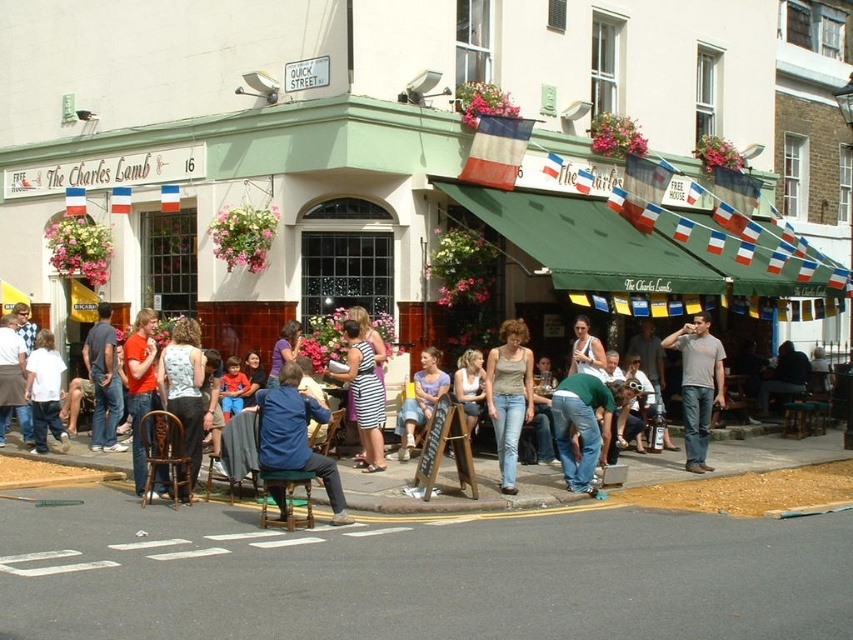
Question: Which of these objects is positioned closest to the denim shorts at center?

Choices:
 (A) white cotton shirt at left
 (B) blue denim jacket at center

Answer: (B)

Question: Is gray cotton t-shirt at center behind matte white tank top at center?

Choices:
 (A) no
 (B) yes

Answer: (A)

Question: Which point appears farthest from the camera in this image?

Choices:
 (A) (524, 384)
 (B) (552, 417)
 (C) (201, 413)
 (D) (103, 426)

Answer: (D)

Question: Is matte beige tank top at center bigger than denim jacket at left?

Choices:
 (A) yes
 (B) no

Answer: (B)

Question: Which point is farther to the camera?

Choices:
 (A) white cotton shirt at left
 (B) white lace blouse at center

Answer: (A)

Question: Is gray cotton t-shirt at center above denim shorts at center?

Choices:
 (A) yes
 (B) no

Answer: (A)